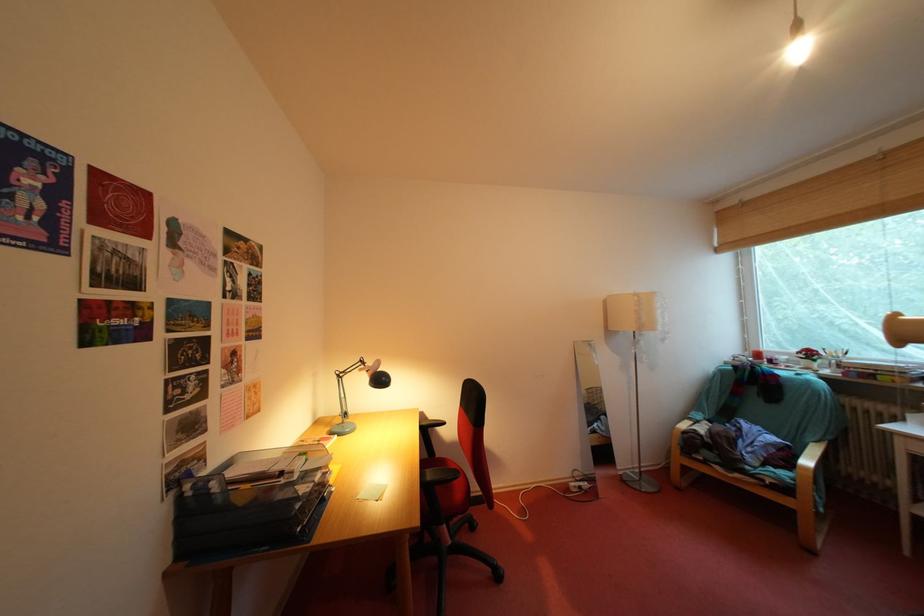
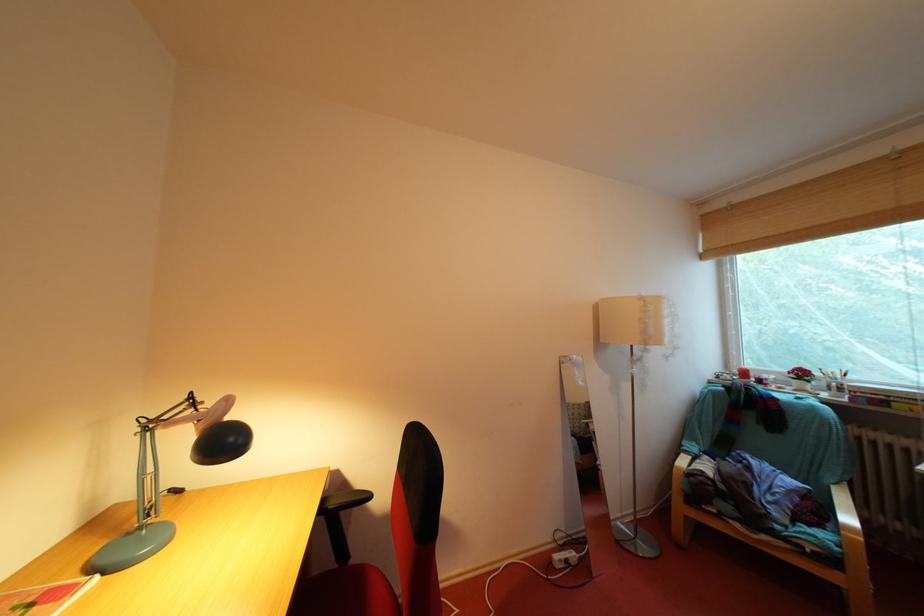
Locate, in the second image, the point that corresponds to point 381,377 in the first image.

(215, 429)